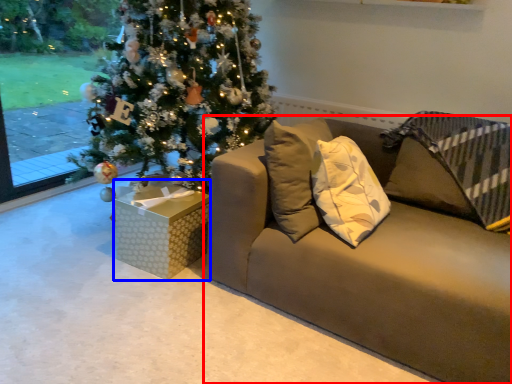
Question: Which object is further to the camera taking this photo, studio couch (highlighted by a red box) or furniture (highlighted by a blue box)?

Choices:
 (A) studio couch
 (B) furniture

Answer: (B)